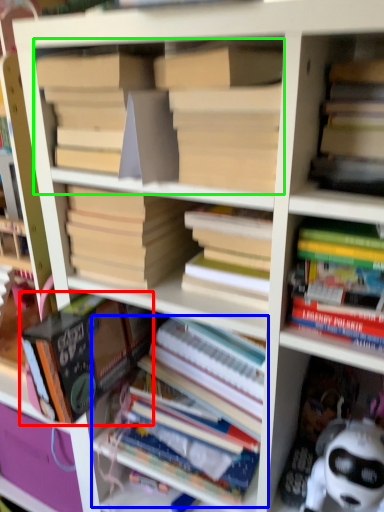
Question: Which object is the closest to the book (highlighted by a red box)? Choose among these: book (highlighted by a blue box) or book (highlighted by a green box).

Choices:
 (A) book
 (B) book

Answer: (A)